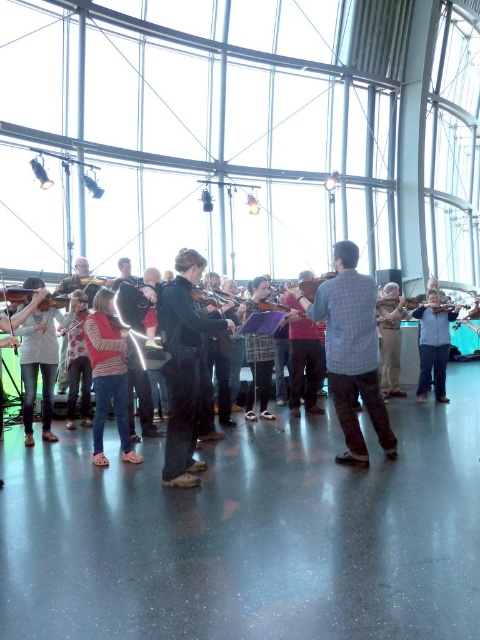
Can you confirm if checkered fabric shirt at center is positioned to the left of black leather jacket at center?

No, checkered fabric shirt at center is not to the left of black leather jacket at center.

Does checkered fabric shirt at center have a greater height compared to black leather jacket at center?

Incorrect, checkered fabric shirt at center's height is not larger of black leather jacket at center's.

Which is behind, point (343, 291) or point (199, 259)?

Positioned behind is point (343, 291).

Identify the location of checkered fabric shirt at center. This screenshot has height=640, width=480. (350, 349).

Does black leather jacket at center have a lesser height compared to black fabric violin at center?

Indeed, black leather jacket at center has a lesser height compared to black fabric violin at center.

Does black leather jacket at center have a smaller size compared to black fabric violin at center?

Yes.

The image size is (480, 640). Describe the element at coordinates (184, 365) in the screenshot. I see `black leather jacket at center` at that location.

Identify the location of black leather jacket at center. (184, 365).

Which is more to the right, light blue denim jeans at center or black fabric violin at center?

Positioned to the right is light blue denim jeans at center.

Measure the distance between point (428, 362) and camera.

Point (428, 362) and camera are 23.93 meters apart.

Locate an element on the screen. This screenshot has height=640, width=480. light blue denim jeans at center is located at coordinates (433, 344).